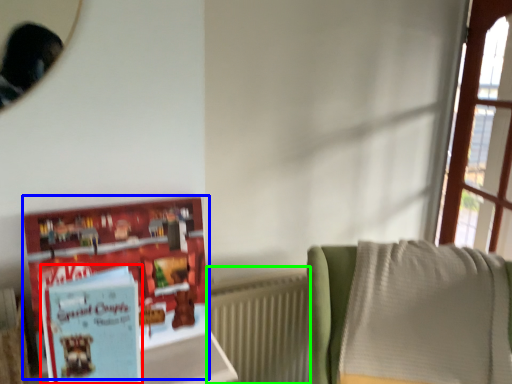
Question: Which is farther away from paperback book (highlighted by a red box)? book (highlighted by a blue box) or radiator (highlighted by a green box)?

Choices:
 (A) book
 (B) radiator

Answer: (B)